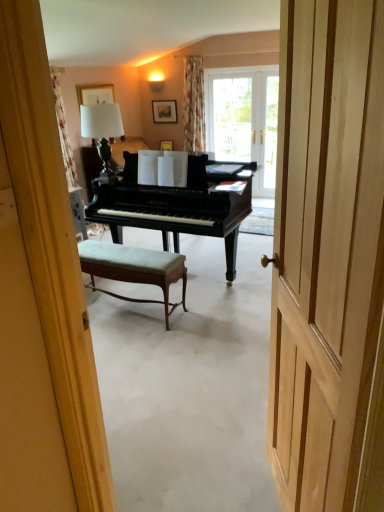
This screenshot has width=384, height=512. What do you see at coordinates (164, 111) in the screenshot?
I see `wooden picture frame at upper center, the first picture frame when ordered from right to left` at bounding box center [164, 111].

What is the approximate height of velvet green stool at center?

velvet green stool at center is 20.62 inches in height.

Looking at this image, how much space does matte wooden picture frame at upper center, acting as the 1th picture frame starting from the left, occupy vertically?

matte wooden picture frame at upper center, acting as the 1th picture frame starting from the left, is 11.27 inches in height.

Find the location of a particular element. The width and height of the screenshot is (384, 512). wooden picture frame at upper center, placed as the first picture frame when sorted from back to front is located at coordinates [164, 111].

Could you measure the distance between white fabric lampshade at upper center and matte wooden picture frame at upper center, acting as the 1th picture frame starting from the left?

The distance of white fabric lampshade at upper center from matte wooden picture frame at upper center, acting as the 1th picture frame starting from the left, is 7.25 inches.

From the picture: Is white fabric lampshade at upper center outside of matte wooden picture frame at upper center, the 2th picture frame in the right-to-left sequence?

white fabric lampshade at upper center is positioned outside matte wooden picture frame at upper center, the 2th picture frame in the right-to-left sequence.

Considering the sizes of white fabric lampshade at upper center and matte wooden picture frame at upper center, the 2th picture frame in the right-to-left sequence, in the image, is white fabric lampshade at upper center taller or shorter than matte wooden picture frame at upper center, the 2th picture frame in the right-to-left sequence,?

white fabric lampshade at upper center is taller than matte wooden picture frame at upper center, the 2th picture frame in the right-to-left sequence.

Identify the location of picture frame located above the white fabric lampshade at upper center (from a real-world perspective). This screenshot has height=512, width=384. (95, 94).

Is point (162, 220) positioned after point (108, 86)?

That is False.

Considering the relative sizes of shiny black piano at center and matte wooden picture frame at upper center, which is the 1th picture frame from front to back, in the image provided, is shiny black piano at center thinner than matte wooden picture frame at upper center, which is the 1th picture frame from front to back,?

No.

Looking at this image, how much distance is there between shiny black piano at center and matte wooden picture frame at upper center, which is the 1th picture frame from front to back?

The distance of shiny black piano at center from matte wooden picture frame at upper center, which is the 1th picture frame from front to back, is 3.80 feet.

Would you say shiny black piano at center is outside matte wooden picture frame at upper center, the second picture frame from the back?

That's correct, shiny black piano at center is outside of matte wooden picture frame at upper center, the second picture frame from the back.

This screenshot has height=512, width=384. I want to click on window screen directly beneath the wooden picture frame at upper center, the 2th picture frame when ordered from front to back (from a real-world perspective), so click(232, 118).

Does transparent glass door at upper center have a greater width compared to wooden picture frame at upper center, placed as the 2th picture frame when sorted from left to right?

Yes, transparent glass door at upper center is wider than wooden picture frame at upper center, placed as the 2th picture frame when sorted from left to right.

From the image's perspective, is transparent glass door at upper center located beneath wooden picture frame at upper center, the first picture frame when ordered from right to left?

Yes, from the image's perspective, transparent glass door at upper center is below wooden picture frame at upper center, the first picture frame when ordered from right to left.

Considering the relative sizes of transparent glass door at upper center and matte wooden picture frame at upper center, which is the 1th picture frame from front to back, in the image provided, is transparent glass door at upper center bigger than matte wooden picture frame at upper center, which is the 1th picture frame from front to back,?

Yes.

Does transparent glass door at upper center turn towards matte wooden picture frame at upper center, the second picture frame from the back?

No, transparent glass door at upper center is not facing towards matte wooden picture frame at upper center, the second picture frame from the back.

Who is taller, transparent glass door at upper center or matte wooden picture frame at upper center, the second picture frame from the back?

transparent glass door at upper center is taller.

Can you tell me how much transparent glass door at upper center and matte wooden picture frame at upper center, the second picture frame from the back, differ in facing direction?

The angular difference between transparent glass door at upper center and matte wooden picture frame at upper center, the second picture frame from the back, is 89.6 degrees.

From the image's perspective, is wooden picture frame at upper center, placed as the first picture frame when sorted from back to front, under velvet green stool at center?

No, from the image's perspective, wooden picture frame at upper center, placed as the first picture frame when sorted from back to front, is not below velvet green stool at center.

Considering the positions of objects wooden picture frame at upper center, the first picture frame when ordered from right to left, and velvet green stool at center in the image provided, who is more to the right, wooden picture frame at upper center, the first picture frame when ordered from right to left, or velvet green stool at center?

wooden picture frame at upper center, the first picture frame when ordered from right to left, is more to the right.

Which picture frame is the 2nd one when counting from the back of the velvet green stool at center? Please provide its 2D coordinates.

[(164, 111)]

From a real-world perspective, is wooden picture frame at upper center, the 2th picture frame when ordered from front to back, positioned under velvet green stool at center based on gravity?

No, from a real-world perspective, wooden picture frame at upper center, the 2th picture frame when ordered from front to back, is not beneath velvet green stool at center.

Can we say matte wooden picture frame at upper center, which is the 1th picture frame from front to back, lies outside wooden door at center?

Indeed, matte wooden picture frame at upper center, which is the 1th picture frame from front to back, is completely outside wooden door at center.

In the scene shown: Can you confirm if matte wooden picture frame at upper center, acting as the 1th picture frame starting from the left, is bigger than wooden door at center?

No.

In the image, is matte wooden picture frame at upper center, which is the 1th picture frame from front to back, on the left side or the right side of wooden door at center?

Clearly, matte wooden picture frame at upper center, which is the 1th picture frame from front to back, is on the left of wooden door at center in the image.

From the image's perspective, between matte wooden picture frame at upper center, the 2th picture frame in the right-to-left sequence, and wooden door at center, which one is located above?

matte wooden picture frame at upper center, the 2th picture frame in the right-to-left sequence, from the image's perspective.

How many degrees apart are the facing directions of white fabric lampshade at upper center and velvet green stool at center?

180 degrees.

Would you say white fabric lampshade at upper center is a long distance from velvet green stool at center?

white fabric lampshade at upper center is positioned a significant distance from velvet green stool at center.

From a real-world perspective, who is located higher, white fabric lampshade at upper center or velvet green stool at center?

In real-world perspective, white fabric lampshade at upper center is above.

Where is `lamp that is below the matte wooden picture frame at upper center, which is the 1th picture frame from front to back (from the image's perspective)`? This screenshot has width=384, height=512. lamp that is below the matte wooden picture frame at upper center, which is the 1th picture frame from front to back (from the image's perspective) is located at coordinates tap(102, 132).

You are a GUI agent. You are given a task and a screenshot of the screen. Output one action in this format:
    pyautogui.click(x=<x>, y=<y>)
    Task: Click on the piano below the matte wooden picture frame at upper center, acting as the 1th picture frame starting from the left (from a real-world perspective)
    
    Given the screenshot: What is the action you would take?
    pyautogui.click(x=177, y=204)

Estimate the real-world distances between objects in this image. Which object is further from wooden picture frame at upper center, the first picture frame when ordered from right to left, white fabric lampshade at upper center or shiny black piano at center?

shiny black piano at center is positioned further to the anchor wooden picture frame at upper center, the first picture frame when ordered from right to left.

Considering their positions, is wooden door at center positioned further to shiny black piano at center than matte wooden picture frame at upper center, which is the 1th picture frame from front to back?

wooden door at center.

Estimate the real-world distances between objects in this image. Which object is further from white fabric lampshade at upper center, matte wooden picture frame at upper center, which is the 1th picture frame from front to back, or wooden door at center?

wooden door at center is further to white fabric lampshade at upper center.

Estimate the real-world distances between objects in this image. Which object is closer to velvet green stool at center, matte wooden picture frame at upper center, the 2th picture frame in the right-to-left sequence, or wooden door at center?

Based on the image, matte wooden picture frame at upper center, the 2th picture frame in the right-to-left sequence, appears to be nearer to velvet green stool at center.

Looking at the image, which one is located closer to transparent glass door at upper center, velvet green stool at center or matte wooden picture frame at upper center, the second picture frame from the back?

matte wooden picture frame at upper center, the second picture frame from the back.

Based on their spatial positions, is transparent glass door at upper center or velvet green stool at center further from wooden door at center?

transparent glass door at upper center lies further to wooden door at center than the other object.

Considering their positions, is wooden picture frame at upper center, the first picture frame when ordered from right to left, positioned closer to white fabric lampshade at upper center than velvet green stool at center?

Among the two, velvet green stool at center is located nearer to white fabric lampshade at upper center.

Looking at the image, which one is located closer to velvet green stool at center, wooden door at center or transparent glass door at upper center?

wooden door at center lies closer to velvet green stool at center than the other object.

Find the location of a particular element. This screenshot has width=384, height=512. picture frame between wooden door at center and wooden picture frame at upper center, placed as the 2th picture frame when sorted from left to right, in the front-back direction is located at coordinates (95, 94).

The image size is (384, 512). Find the location of `piano between wooden door at center and wooden picture frame at upper center, the first picture frame when ordered from right to left, from front to back`. piano between wooden door at center and wooden picture frame at upper center, the first picture frame when ordered from right to left, from front to back is located at coordinates (177, 204).

Locate an element on the screen. window screen positioned between white fabric lampshade at upper center and wooden picture frame at upper center, placed as the 2th picture frame when sorted from left to right, from near to far is located at coordinates (232, 118).

Locate an element on the screen. This screenshot has height=512, width=384. picture frame positioned between wooden door at center and transparent glass door at upper center from near to far is located at coordinates (95, 94).